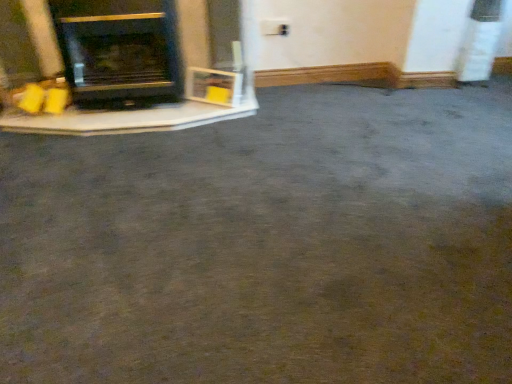
Question: Considering the positions of black matte wood burning stove at left and matte black fireplace at left in the image, is black matte wood burning stove at left taller or shorter than matte black fireplace at left?

Choices:
 (A) tall
 (B) short

Answer: (A)

Question: Is black matte wood burning stove at left wider or thinner than matte black fireplace at left?

Choices:
 (A) wide
 (B) thin

Answer: (A)

Question: Is black matte wood burning stove at left situated inside matte black fireplace at left or outside?

Choices:
 (A) outside
 (B) inside

Answer: (B)

Question: From the image's perspective, relative to black matte wood burning stove at left, is matte black fireplace at left above or below?

Choices:
 (A) below
 (B) above

Answer: (B)

Question: In terms of height, does matte black fireplace at left look taller or shorter compared to black matte wood burning stove at left?

Choices:
 (A) short
 (B) tall

Answer: (A)

Question: From a real-world perspective, is matte black fireplace at left physically located above or below black matte wood burning stove at left?

Choices:
 (A) below
 (B) above

Answer: (A)

Question: In the image, is matte black fireplace at left on the left side or the right side of black matte wood burning stove at left?

Choices:
 (A) left
 (B) right

Answer: (A)